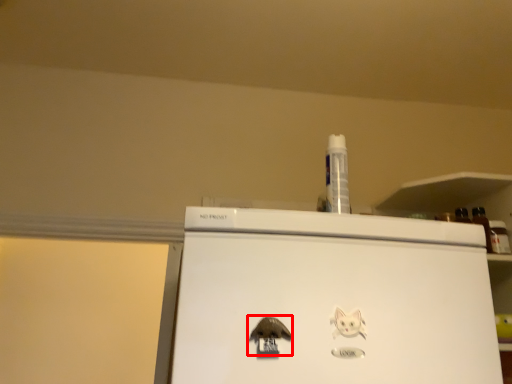
Question: From the image's perspective, where is animal (annotated by the red box) located relative to animal?

Choices:
 (A) above
 (B) below

Answer: (B)